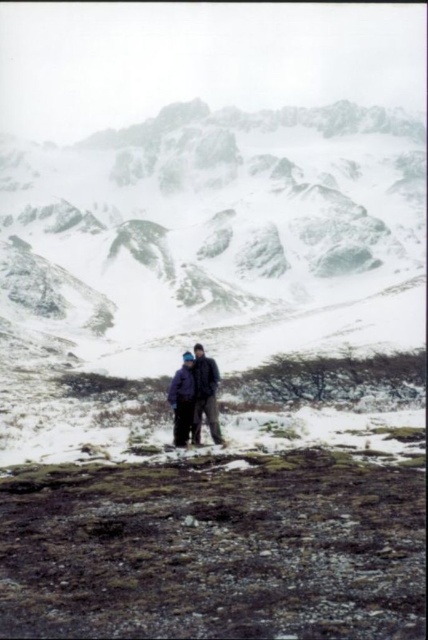
You are a hiker who wants to reach the snowy rock mountain at center from your current position near the matte purple jacket at center. Based on the terrain described, what challenge might you face in covering the 106.98 meters distance?

The distance between the snowy rock mountain at center and the matte purple jacket at center is 106.98 meters. The rugged and uneven terrain covered in snow and patches of exposed earth or rocks may make the journey physically challenging due to the difficult footing and potential slippery conditions.

From the picture: You are an observer looking at the snowy mountain scene. You notice the matte purple jacket at center. Can you determine its exact 2D coordinates in the image?

The matte purple jacket at center is located at the 2D coordinates of point (196, 396).